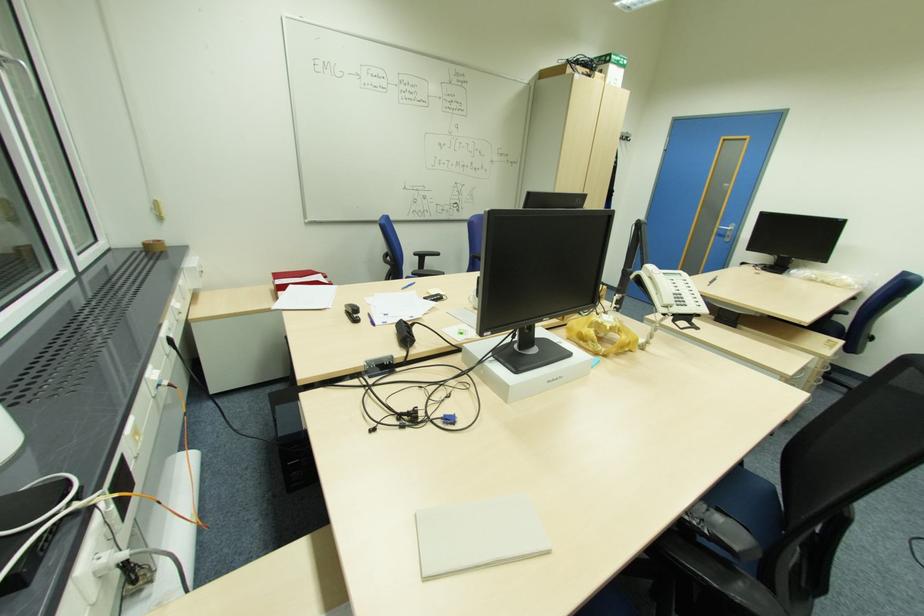
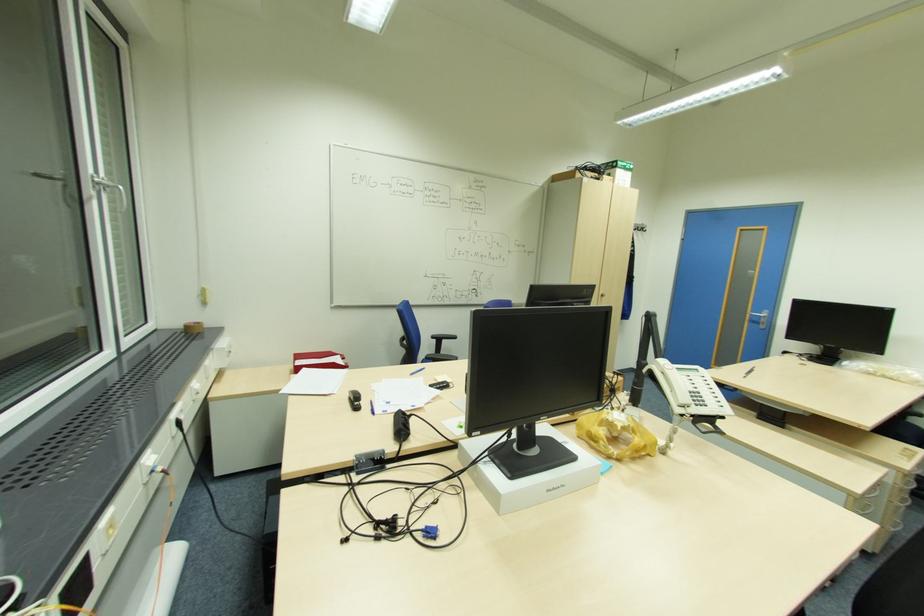
Question: The first image is from the beginning of the video and the second image is from the end. How did the camera likely rotate when shooting the video?

Choices:
 (A) Left
 (B) Right
 (C) Up
 (D) Down

Answer: (C)